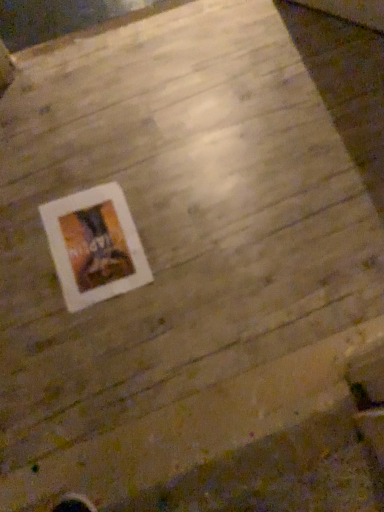
I want to click on vacant space positioned to the left of white matte picture frame at center, so click(x=25, y=260).